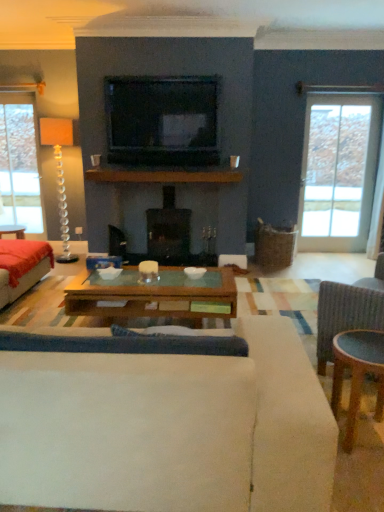
The height and width of the screenshot is (512, 384). What do you see at coordinates (169, 429) in the screenshot?
I see `white fabric studio couch at center, which is the second studio couch from left to right` at bounding box center [169, 429].

Locate an element on the screen. black glass fireplace at center is located at coordinates (168, 230).

Identify the location of clear glass door at right. (339, 166).

Describe the element at coordinates (22, 267) in the screenshot. I see `velvet red couch at left, placed as the second studio couch when sorted from right to left` at that location.

Image resolution: width=384 pixels, height=512 pixels. What do you see at coordinates (59, 174) in the screenshot?
I see `clear glass lamp at left` at bounding box center [59, 174].

Where is `black glossy television at upper center`? Image resolution: width=384 pixels, height=512 pixels. black glossy television at upper center is located at coordinates (162, 121).

In order to click on window below the black glossy television at upper center (from a real-world perspective) in this screenshot , I will do `click(339, 166)`.

Considering the relative sizes of clear glass door at right and black glossy television at upper center in the image provided, is clear glass door at right wider than black glossy television at upper center?

No, clear glass door at right is not wider than black glossy television at upper center.

Based on the photo, from the image's perspective, is clear glass door at right above black glossy television at upper center?

No, from the image's perspective, clear glass door at right is not over black glossy television at upper center.

In the scene shown: Considering their positions, is clear glass door at right located in front of or behind black glossy television at upper center?

Visually, clear glass door at right is located behind black glossy television at upper center.

Is clear glass lamp at left oriented away from velvet red couch at left, the second studio couch viewed from the front?

No, clear glass lamp at left's orientation is not away from velvet red couch at left, the second studio couch viewed from the front.

Between point (45, 123) and point (2, 252), which one is positioned behind?

Point (45, 123)

Does clear glass lamp at left appear on the right side of velvet red couch at left, which appears as the first studio couch when viewed from the back?

Indeed, clear glass lamp at left is positioned on the right side of velvet red couch at left, which appears as the first studio couch when viewed from the back.

Considering the sizes of clear glass lamp at left and velvet red couch at left, acting as the 1th studio couch starting from the left, in the image, is clear glass lamp at left bigger or smaller than velvet red couch at left, acting as the 1th studio couch starting from the left,?

Considering their sizes, clear glass lamp at left takes up less space than velvet red couch at left, acting as the 1th studio couch starting from the left.

The width and height of the screenshot is (384, 512). I want to click on fireplace that appears above the wooden glass coffee table at center (from a real-world perspective), so click(x=168, y=230).

Which object is positioned more to the right, black glass fireplace at center or wooden glass coffee table at center?

Positioned to the right is wooden glass coffee table at center.

Looking at this image, from the image's perspective, does black glass fireplace at center appear lower than wooden glass coffee table at center?

No.

Looking at the image, does black glass fireplace at center seem bigger or smaller compared to wooden glass coffee table at center?

Considering their sizes, black glass fireplace at center takes up more space than wooden glass coffee table at center.

Is white fabric studio couch at center, which is the second studio couch from left to right, bigger than black glass fireplace at center?

Yes, white fabric studio couch at center, which is the second studio couch from left to right, is bigger than black glass fireplace at center.

Is white fabric studio couch at center, which is the second studio couch from left to right, positioned behind black glass fireplace at center?

That is False.

Is point (20, 457) more distant than point (146, 220)?

No, it is in front of (146, 220).

In the scene shown: How far apart are white fabric studio couch at center, placed as the 2th studio couch when sorted from back to front, and clear glass lamp at left?

They are 4.66 meters apart.

Is white fabric studio couch at center, placed as the 2th studio couch when sorted from back to front, spatially inside clear glass lamp at left, or outside of it?

white fabric studio couch at center, placed as the 2th studio couch when sorted from back to front, exists outside the volume of clear glass lamp at left.

From a real-world perspective, between white fabric studio couch at center, placed as the 2th studio couch when sorted from back to front, and clear glass lamp at left, who is vertically lower?

white fabric studio couch at center, placed as the 2th studio couch when sorted from back to front.

I want to click on lamp located above the white fabric studio couch at center, placed as the 2th studio couch when sorted from back to front (from a real-world perspective), so click(x=59, y=174).

Which object is closer to the camera, black glass fireplace at center or black glossy television at upper center?

black glossy television at upper center.

Based on their positions, is black glass fireplace at center located to the left or right of black glossy television at upper center?

Clearly, black glass fireplace at center is on the right of black glossy television at upper center in the image.

Does point (168, 256) lie in front of point (162, 106)?

No, it is not.

Does black glass fireplace at center have a greater width compared to black glossy television at upper center?

Yes.

Does white fabric studio couch at center, which is counted as the 1th studio couch, starting from the front, have a greater width compared to black glossy television at upper center?

Correct, the width of white fabric studio couch at center, which is counted as the 1th studio couch, starting from the front, exceeds that of black glossy television at upper center.

Could you tell me if white fabric studio couch at center, which is the second studio couch from left to right, is turned towards black glossy television at upper center?

No, white fabric studio couch at center, which is the second studio couch from left to right, does not turn towards black glossy television at upper center.

Can you confirm if white fabric studio couch at center, placed as the 2th studio couch when sorted from back to front, is positioned to the left of black glossy television at upper center?

Yes, white fabric studio couch at center, placed as the 2th studio couch when sorted from back to front, is to the left of black glossy television at upper center.

Find the location of a particular element. television in front of the clear glass door at right is located at coordinates (162, 121).

I want to click on studio couch located on the left of clear glass lamp at left, so click(22, 267).

When comparing their distances from white fabric studio couch at center, which is counted as the 1th studio couch, starting from the front, does velvet red couch at left, acting as the 1th studio couch starting from the left, or clear glass lamp at left seem further?

Among the two, clear glass lamp at left is located further to white fabric studio couch at center, which is counted as the 1th studio couch, starting from the front.

Based on their spatial positions, is black glossy television at upper center or clear glass lamp at left further from wooden glass coffee table at center?

Among the two, clear glass lamp at left is located further to wooden glass coffee table at center.

From the picture: Looking at the image, which one is located further to clear glass door at right, wooden glass coffee table at center or black glass fireplace at center?

wooden glass coffee table at center lies further to clear glass door at right than the other object.

From the image, which object appears to be farther from wooden glass coffee table at center, velvet red couch at left, acting as the 1th studio couch starting from the left, or black glass fireplace at center?

black glass fireplace at center lies further to wooden glass coffee table at center than the other object.

From the picture: Which object lies further to the anchor point clear glass lamp at left, white fabric studio couch at center, placed as the 2th studio couch when sorted from back to front, or clear glass door at right?

white fabric studio couch at center, placed as the 2th studio couch when sorted from back to front, is positioned further to the anchor clear glass lamp at left.

Based on their spatial positions, is wooden glass coffee table at center or white fabric studio couch at center, the 1th studio couch in the right-to-left sequence, further from velvet red couch at left, placed as the second studio couch when sorted from right to left?

wooden glass coffee table at center is positioned further to the anchor velvet red couch at left, placed as the second studio couch when sorted from right to left.

Considering their positions, is white fabric studio couch at center, which is the second studio couch from left to right, positioned further to black glossy television at upper center than clear glass lamp at left?

Based on the image, white fabric studio couch at center, which is the second studio couch from left to right, appears to be further to black glossy television at upper center.

Which object lies further to the anchor point black glass fireplace at center, wooden glass coffee table at center or velvet red couch at left, placed as the second studio couch when sorted from right to left?

wooden glass coffee table at center lies further to black glass fireplace at center than the other object.

Where is `studio couch located between wooden glass coffee table at center and black glass fireplace at center in the depth direction`? This screenshot has height=512, width=384. studio couch located between wooden glass coffee table at center and black glass fireplace at center in the depth direction is located at coordinates (22, 267).

You are a GUI agent. You are given a task and a screenshot of the screen. Output one action in this format:
    pyautogui.click(x=<x>, y=<y>)
    Task: Click on the television between wooden glass coffee table at center and clear glass door at right along the z-axis
    The image size is (384, 512).
    Given the screenshot: What is the action you would take?
    pyautogui.click(x=162, y=121)

Find the location of a particular element. This screenshot has width=384, height=512. lamp between white fabric studio couch at center, the 1th studio couch in the right-to-left sequence, and clear glass door at right in the front-back direction is located at coordinates (59, 174).

Identify the location of lamp between velvet red couch at left, which appears as the first studio couch when viewed from the back, and black glossy television at upper center, in the horizontal direction. This screenshot has width=384, height=512. point(59,174).